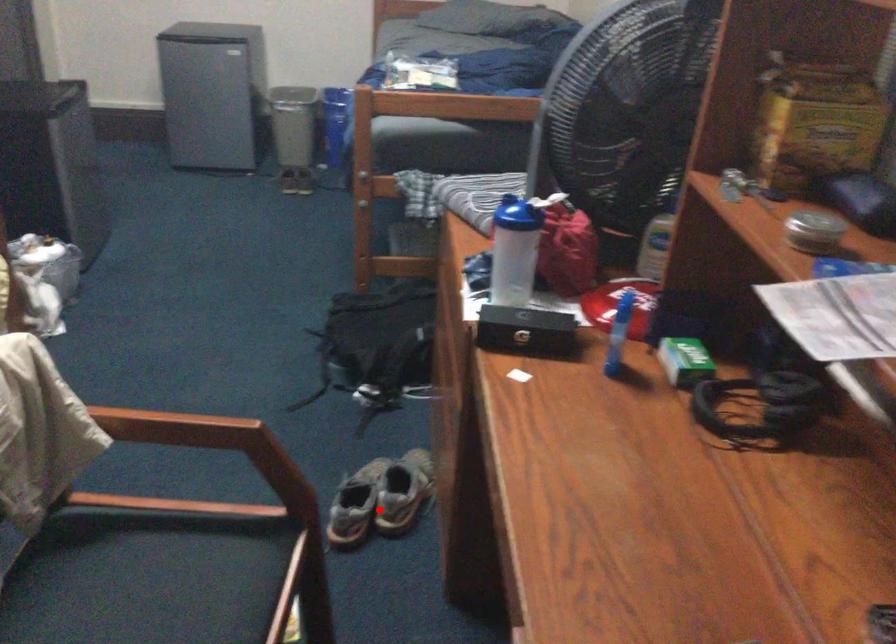
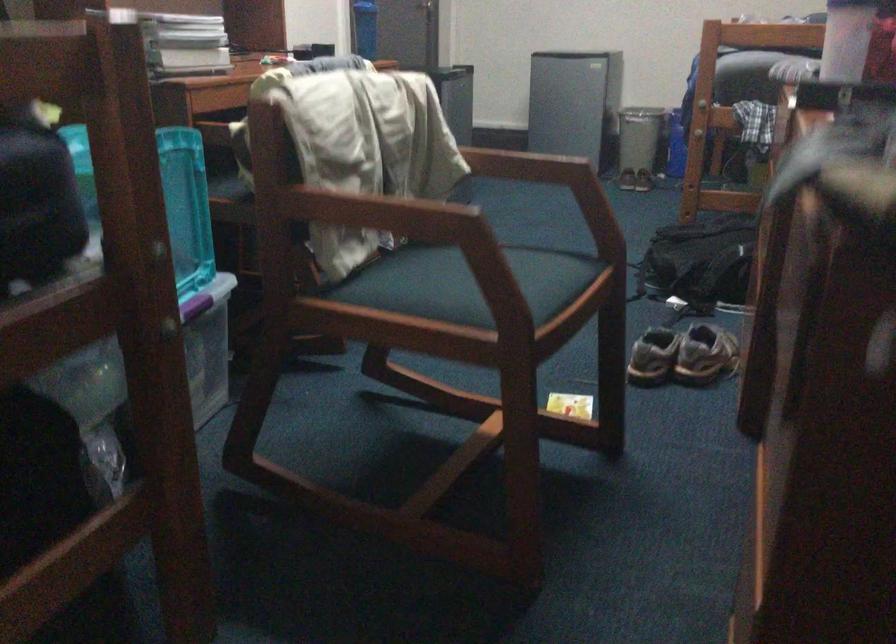
The point at the highlighted location is marked in the first image. Where is the corresponding point in the second image?

(682, 355)